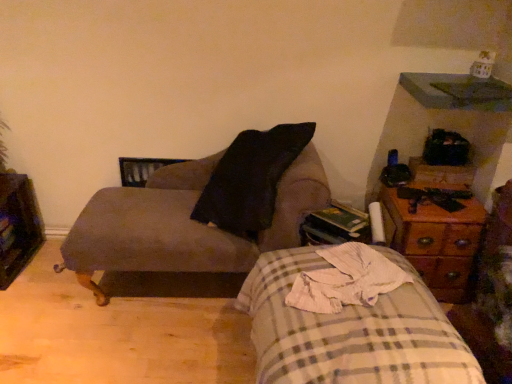
Question: Is woodenmaterial/texturenightstand at right to the left of suede-like brown chair at upper left from the viewer's perspective?

Choices:
 (A) yes
 (B) no

Answer: (B)

Question: Can you confirm if woodenmaterial/texturenightstand at right is shorter than suede-like brown chair at upper left?

Choices:
 (A) yes
 (B) no

Answer: (A)

Question: Does woodenmaterial/texturenightstand at right appear on the right side of suede-like brown chair at upper left?

Choices:
 (A) no
 (B) yes

Answer: (B)

Question: Is there a large distance between woodenmaterial/texturenightstand at right and suede-like brown chair at upper left?

Choices:
 (A) yes
 (B) no

Answer: (B)

Question: Is the surface of woodenmaterial/texturenightstand at right in direct contact with suede-like brown chair at upper left?

Choices:
 (A) yes
 (B) no

Answer: (B)

Question: Does woodenmaterial/texturenightstand at right have a larger size compared to suede-like brown chair at upper left?

Choices:
 (A) no
 (B) yes

Answer: (A)

Question: Is wooden dresser at left not within plaid fabric bed at lower right?

Choices:
 (A) yes
 (B) no

Answer: (A)

Question: Can you confirm if wooden dresser at left is bigger than plaid fabric bed at lower right?

Choices:
 (A) no
 (B) yes

Answer: (A)

Question: Is wooden dresser at left positioned behind plaid fabric bed at lower right?

Choices:
 (A) no
 (B) yes

Answer: (B)

Question: From the image's perspective, is wooden dresser at left located beneath plaid fabric bed at lower right?

Choices:
 (A) no
 (B) yes

Answer: (A)

Question: Can you confirm if wooden dresser at left is thinner than plaid fabric bed at lower right?

Choices:
 (A) no
 (B) yes

Answer: (B)

Question: Does wooden dresser at left come in front of plaid fabric bed at lower right?

Choices:
 (A) yes
 (B) no

Answer: (B)

Question: Is the depth of wooden dresser at left greater than that of woodenmaterial/texturenightstand at right?

Choices:
 (A) yes
 (B) no

Answer: (A)